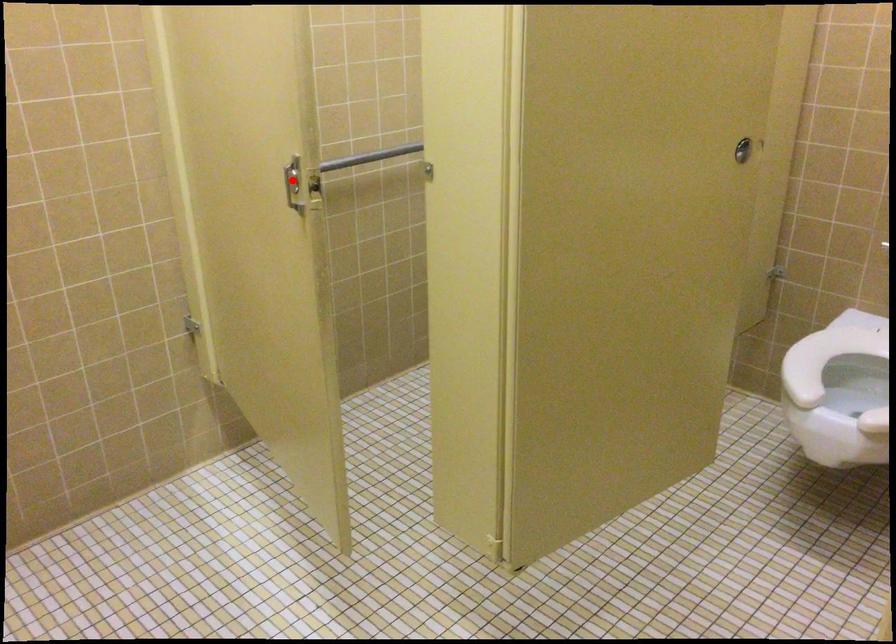
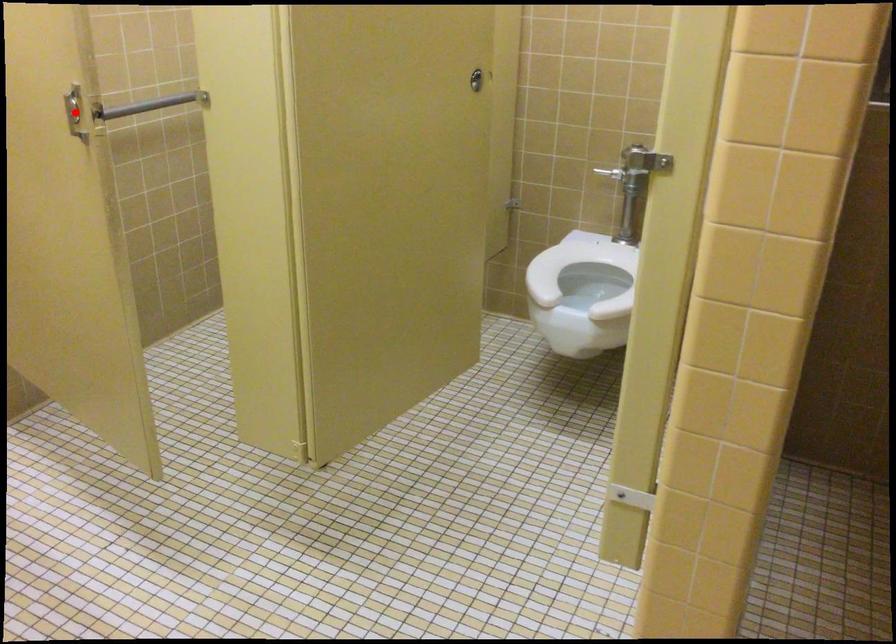
I am providing you with two images of the same scene from different viewpoints. A red point is marked on the first image and another point is marked on the second image. Does the point marked in image1 correspond to the same location as the one in image2?

Yes